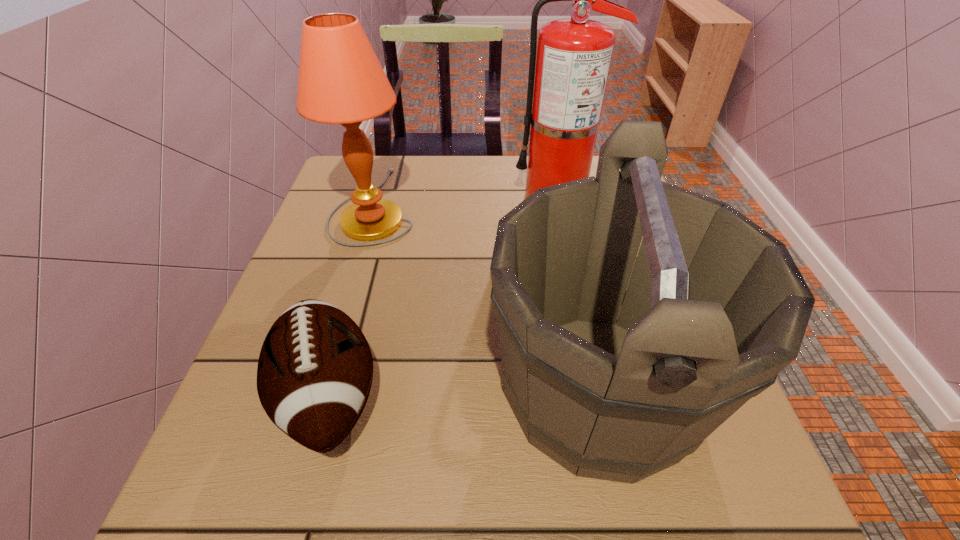
Identify the location of object that is positioned at the far right corner. (573, 60).

Where is `object situated at the near right corner`? object situated at the near right corner is located at coordinates (715, 308).

Locate an element on the screen. The image size is (960, 540). free space at the far edge of the desktop is located at coordinates (411, 156).

I want to click on vacant space at the left edge, so click(x=292, y=268).

This screenshot has width=960, height=540. Identify the location of vacant space at the far left corner. (381, 161).

Locate an element on the screen. free spot between the football (American) and the fire extinguisher is located at coordinates (443, 297).

I want to click on free spot between the lamp and the football (American), so 352,301.

This screenshot has width=960, height=540. In order to click on free space between the bucket and the lamp in this screenshot , I will do `click(487, 297)`.

Image resolution: width=960 pixels, height=540 pixels. In order to click on vacant region between the bucket and the football (American) in this screenshot , I will do `click(464, 393)`.

Image resolution: width=960 pixels, height=540 pixels. I want to click on vacant area between the fire extinguisher and the football (American), so click(443, 297).